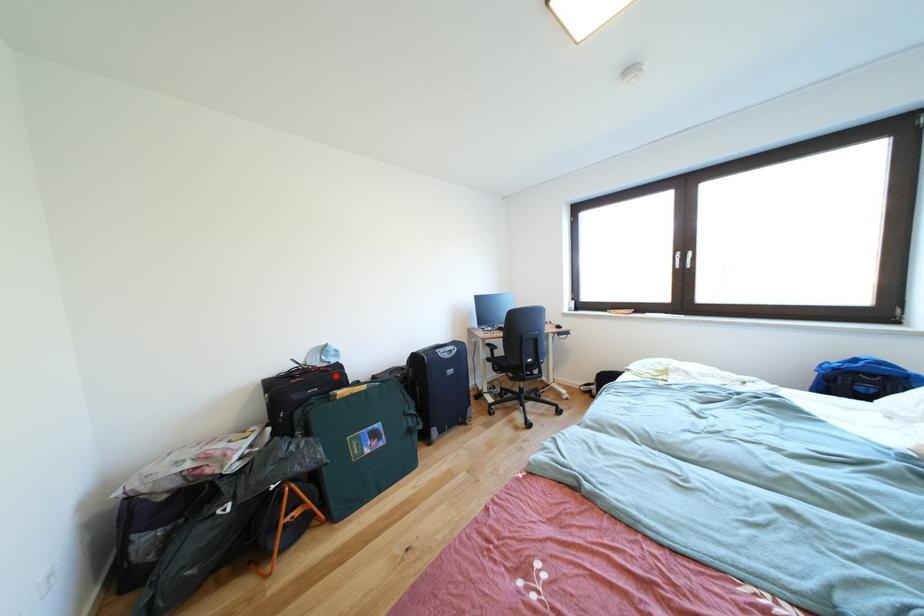
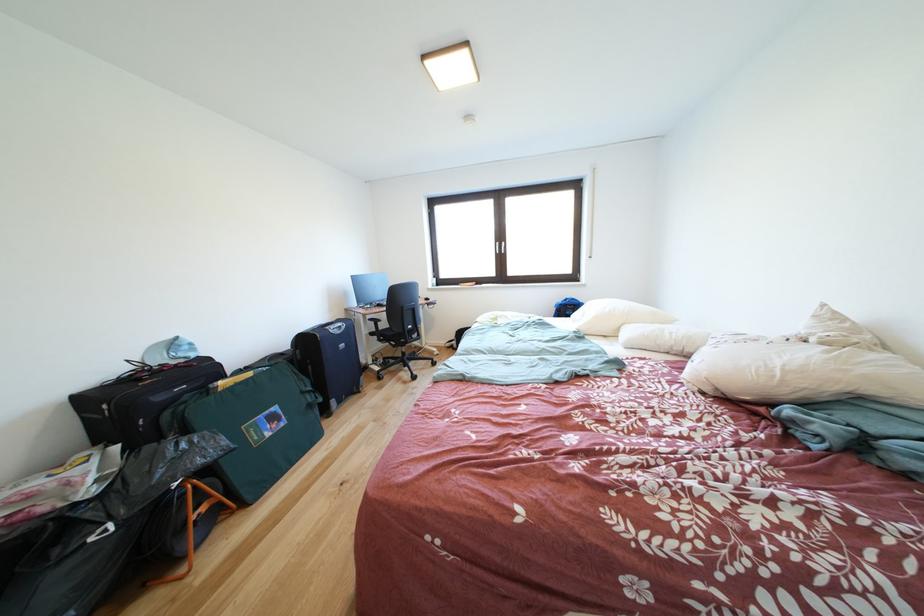
Locate, in the second image, the point that corresponds to the highlighted location in the first image.

(200, 371)